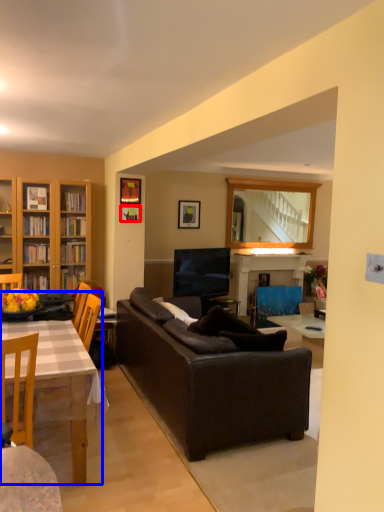
Question: Which object is closer to the camera taking this photo, picture frame (highlighted by a red box) or table (highlighted by a blue box)?

Choices:
 (A) picture frame
 (B) table

Answer: (B)